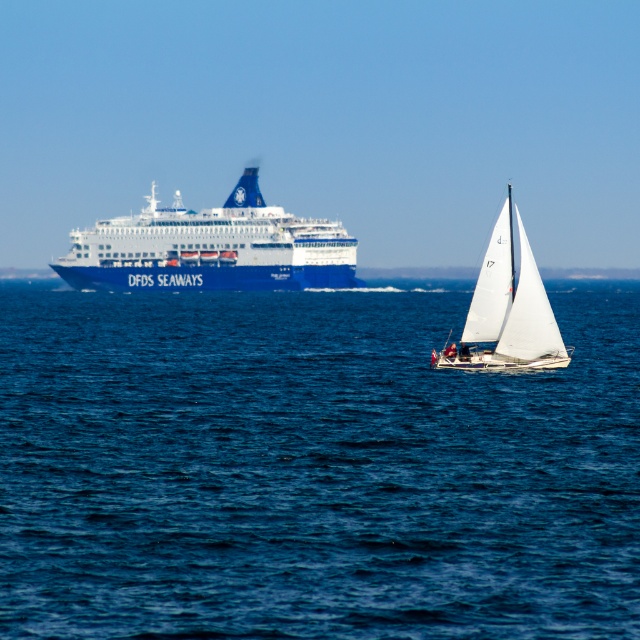
Question: Which point appears farthest from the camera in this image?

Choices:
 (A) (616, 275)
 (B) (333, 579)

Answer: (A)

Question: Is blue water at center behind blue matte water at upper center?

Choices:
 (A) no
 (B) yes

Answer: (A)

Question: Can you confirm if blue water at center is thinner than white sailboat at center?

Choices:
 (A) yes
 (B) no

Answer: (B)

Question: Where is blue water at center located in relation to blue metallic cruise ship at upper left in the image?

Choices:
 (A) right
 (B) left

Answer: (A)

Question: Which object is the farthest from the blue matte water at upper center?

Choices:
 (A) white sailboat at center
 (B) blue metallic cruise ship at upper left
 (C) blue water at center

Answer: (A)

Question: Which point is closer to the camera taking this photo?

Choices:
 (A) (516, 288)
 (B) (16, 440)
 (C) (154, 236)
 (D) (406, 275)

Answer: (B)